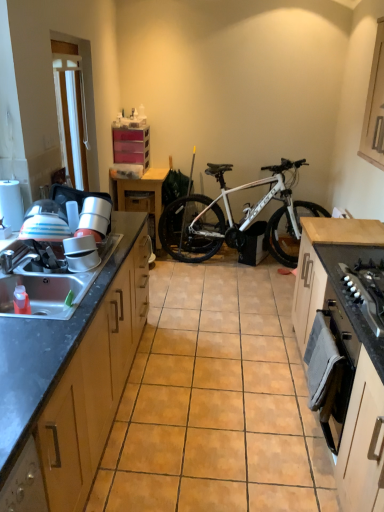
Question: Does white metallic bicycle at center have a greater height compared to brushed metal faucet at sink left?

Choices:
 (A) yes
 (B) no

Answer: (A)

Question: Considering the relative sizes of white metallic bicycle at center and brushed metal faucet at sink left in the image provided, is white metallic bicycle at center thinner than brushed metal faucet at sink left?

Choices:
 (A) yes
 (B) no

Answer: (B)

Question: From the image's perspective, does white metallic bicycle at center appear lower than brushed metal faucet at sink left?

Choices:
 (A) yes
 (B) no

Answer: (B)

Question: Is there a large distance between white metallic bicycle at center and brushed metal faucet at sink left?

Choices:
 (A) no
 (B) yes

Answer: (B)

Question: Is white metallic bicycle at center not within brushed metal faucet at sink left?

Choices:
 (A) yes
 (B) no

Answer: (A)

Question: From the image's perspective, is matte white bowl at sink, the second appliance in the back-to-front sequence, located above or below wooden drawer at center?

Choices:
 (A) below
 (B) above

Answer: (A)

Question: From a real-world perspective, is matte white bowl at sink, the 1th appliance from the front, physically located above or below wooden drawer at center?

Choices:
 (A) above
 (B) below

Answer: (A)

Question: Does point (86, 248) appear closer or farther from the camera than point (125, 206)?

Choices:
 (A) farther
 (B) closer

Answer: (B)

Question: Based on their sizes in the image, would you say matte white bowl at sink, which is the 1th appliance in bottom-to-top order, is bigger or smaller than wooden drawer at center?

Choices:
 (A) big
 (B) small

Answer: (B)

Question: Looking at the image, does brushed metal faucet at sink left seem bigger or smaller compared to metallic silver bowl at left, the 1th appliance when ordered from top to bottom?

Choices:
 (A) big
 (B) small

Answer: (B)

Question: Considering the positions of point (1, 254) and point (97, 202), is point (1, 254) closer or farther from the camera than point (97, 202)?

Choices:
 (A) closer
 (B) farther

Answer: (A)

Question: From the image's perspective, is brushed metal faucet at sink left above or below metallic silver bowl at left, placed as the second appliance when sorted from front to back?

Choices:
 (A) below
 (B) above

Answer: (A)

Question: Is brushed metal faucet at sink left spatially inside metallic silver bowl at left, acting as the second appliance starting from the bottom, or outside of it?

Choices:
 (A) inside
 (B) outside

Answer: (B)

Question: In terms of height, does white plastic window screen at upper left look taller or shorter compared to matte white bowl at sink, the 1th appliance from the front?

Choices:
 (A) short
 (B) tall

Answer: (B)

Question: Choose the correct answer: Is white plastic window screen at upper left inside matte white bowl at sink, the 1th appliance from the front, or outside it?

Choices:
 (A) inside
 (B) outside

Answer: (B)